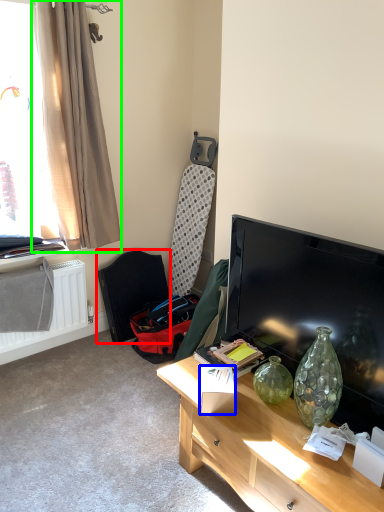
Question: Based on their relative distances, which object is farther from armchair (highlighted by a red box)? Choose from box (highlighted by a blue box) and curtain (highlighted by a green box).

Choices:
 (A) box
 (B) curtain

Answer: (A)